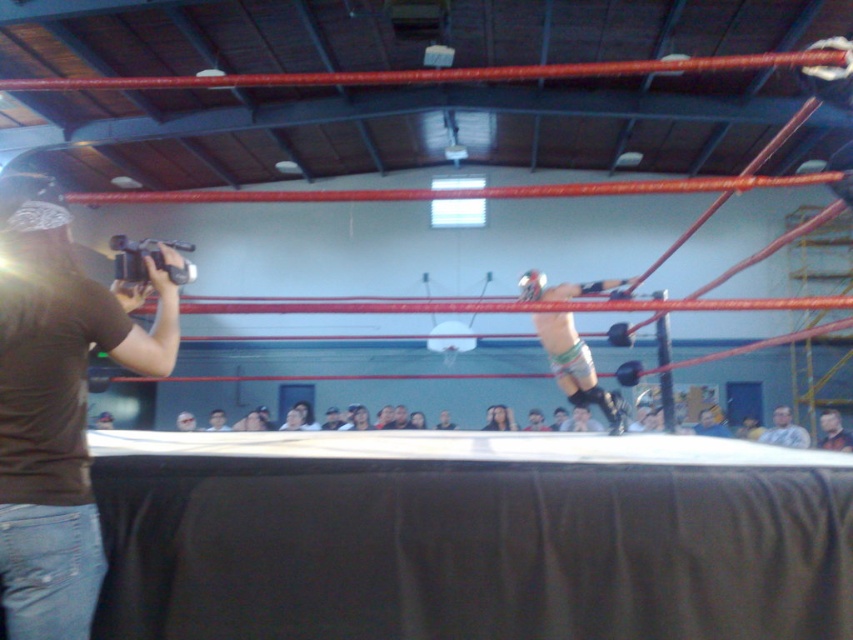
Can you confirm if brown fabric camera at left is thinner than shiny black boots at upper right?

Yes, brown fabric camera at left is thinner than shiny black boots at upper right.

The image size is (853, 640). What do you see at coordinates (57, 406) in the screenshot?
I see `brown fabric camera at left` at bounding box center [57, 406].

Measure the distance between point (167, 371) and camera.

Point (167, 371) and camera are 6.21 feet apart.

You are a GUI agent. You are given a task and a screenshot of the screen. Output one action in this format:
    pyautogui.click(x=<x>, y=<y>)
    Task: Click on the brown fabric camera at left
    
    Given the screenshot: What is the action you would take?
    pyautogui.click(x=57, y=406)

Does shiny black boots at upper right have a lesser width compared to smooth skin face at center?

No.

Is shiny black boots at upper right bigger than smooth skin face at center?

Yes.

What do you see at coordinates (573, 365) in the screenshot? I see `shiny black boots at upper right` at bounding box center [573, 365].

Where is `shiny black boots at upper right`? shiny black boots at upper right is located at coordinates (573, 365).

Between gray fabric shirt at upper right and smooth skin face at center, which one has less height?

smooth skin face at center

Who is more distant from viewer, (767,435) or (404,422)?

The point (404,422) is more distant.

Image resolution: width=853 pixels, height=640 pixels. I want to click on gray fabric shirt at upper right, so click(x=784, y=429).